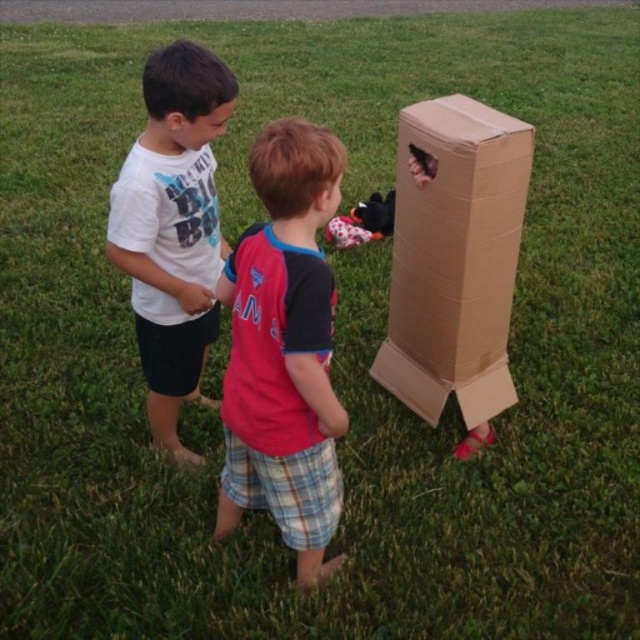
Can you confirm if brown cardboard box at right is positioned below white cotton shirt at center?

Incorrect, brown cardboard box at right is not positioned below white cotton shirt at center.

Identify the location of brown cardboard box at right. (454, 259).

Between point (392, 385) and point (140, 285), which one is positioned behind?

The point (392, 385) is more distant.

Where is `brown cardboard box at right`? brown cardboard box at right is located at coordinates (454, 259).

Who is taller, brown cardboard box at right or black plush toy at center?

With more height is brown cardboard box at right.

Describe the element at coordinates (454, 259) in the screenshot. I see `brown cardboard box at right` at that location.

Locate an element on the screen. This screenshot has width=640, height=640. brown cardboard box at right is located at coordinates (454, 259).

Consider the image. Who is lower down, pink fabric shirt at center or white cotton shirt at center?

pink fabric shirt at center is lower down.

Between point (227, 468) and point (164, 445), which one is positioned in front?

Point (227, 468) is in front.

Where is `pink fabric shirt at center`? The height and width of the screenshot is (640, 640). pink fabric shirt at center is located at coordinates (284, 349).